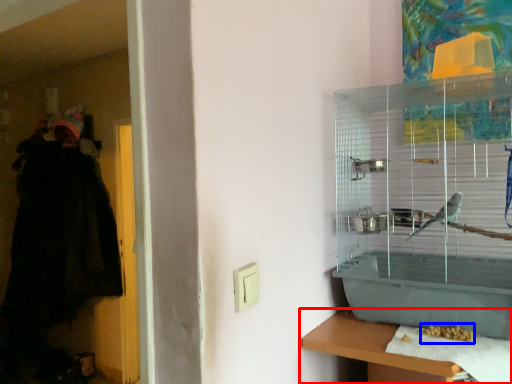
Question: Which point is closer to the camera, shelf (highlighted by a red box) or food (highlighted by a blue box)?

Choices:
 (A) shelf
 (B) food

Answer: (A)